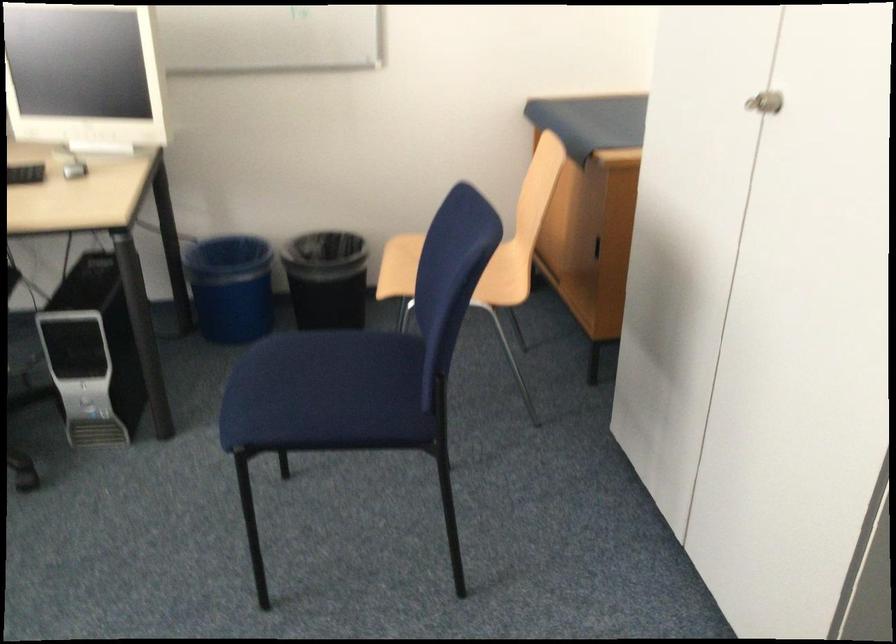
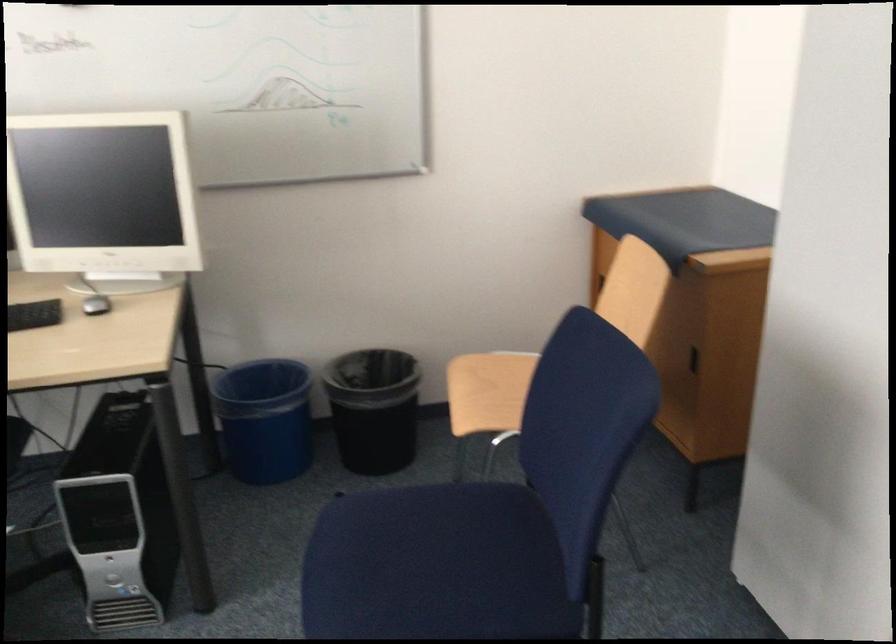
Question: The images are taken continuously from a first-person perspective. In which direction is your viewpoint rotating?

Choices:
 (A) Left
 (B) Right
 (C) Up
 (D) Down

Answer: (C)